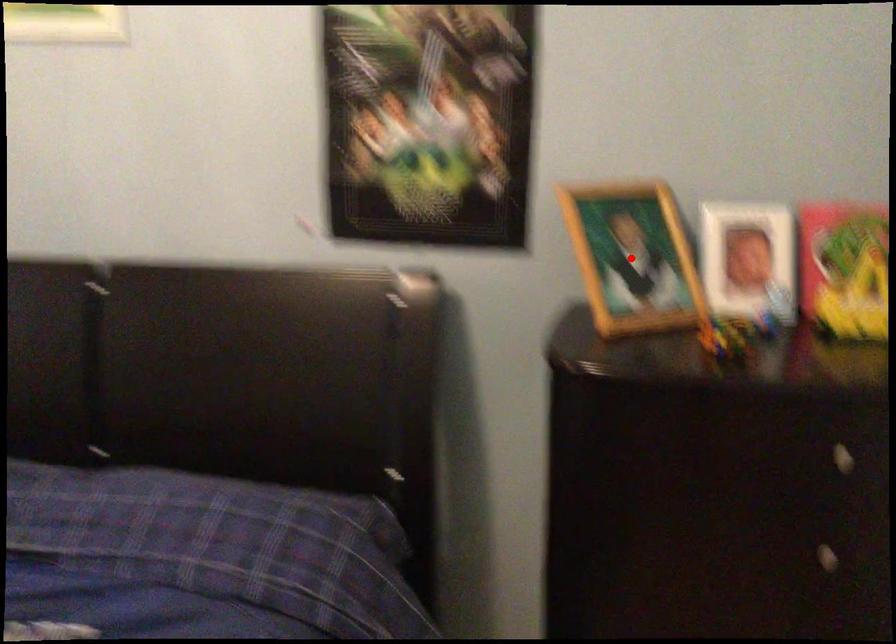
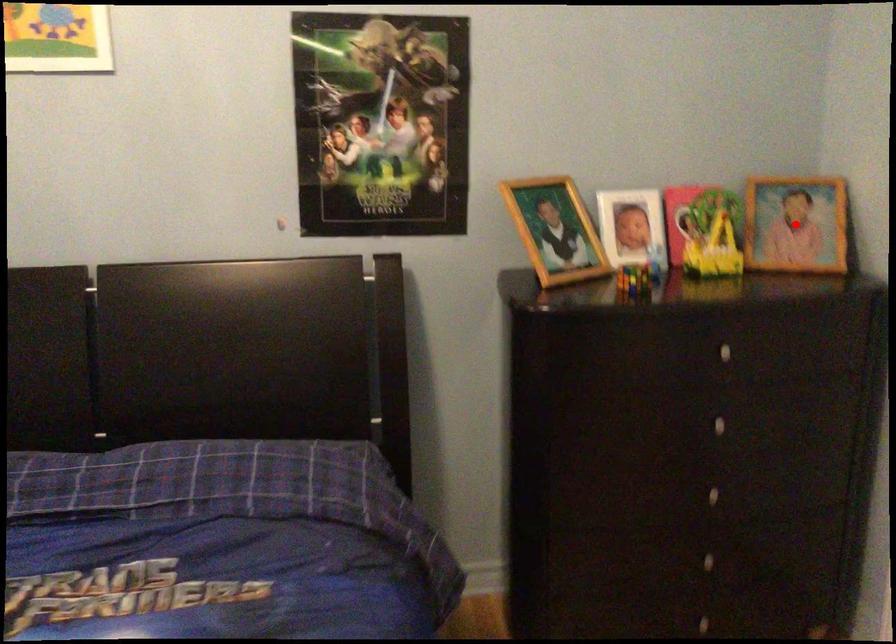
I am providing you with two images of the same scene from different viewpoints. A red point is marked on the first image and another point is marked on the second image. Do the highlighted points in image1 and image2 indicate the same real-world spot?

No